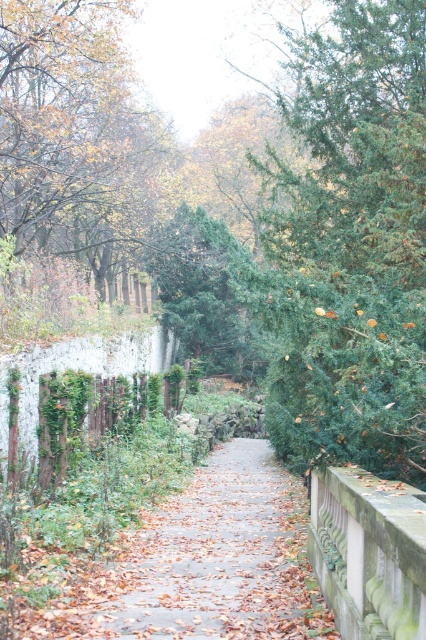
Question: Does brown leafy tree at upper left have a lesser width compared to brown leafy path at center?

Choices:
 (A) yes
 (B) no

Answer: (B)

Question: Estimate the real-world distances between objects in this image. Which object is closer to the brown leafy path at center?

Choices:
 (A) green textured tree at center
 (B) stone balustrade at right
 (C) brown leafy tree at upper left

Answer: (B)

Question: Is brown leafy path at center below stone balustrade at right?

Choices:
 (A) no
 (B) yes

Answer: (B)

Question: Which point is closer to the camera?

Choices:
 (A) (49, 131)
 (B) (155, 508)
 (C) (336, 557)

Answer: (C)

Question: Is green textured tree at center smaller than brown leafy tree at upper left?

Choices:
 (A) no
 (B) yes

Answer: (A)

Question: Which of the following is the closest to the observer?

Choices:
 (A) stone balustrade at right
 (B) green textured tree at center
 (C) brown leafy tree at upper left
 (D) brown leafy path at center

Answer: (A)